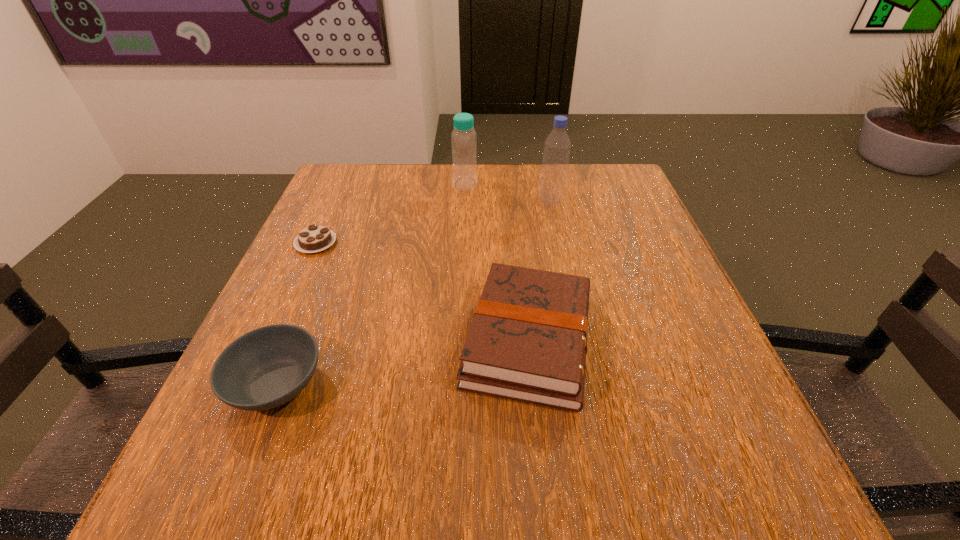
The height and width of the screenshot is (540, 960). Identify the location of free point at the near right corner. (708, 509).

The height and width of the screenshot is (540, 960). In order to click on free spot between the soup bowl and the fourth nearest object in this screenshot , I will do `click(414, 293)`.

The image size is (960, 540). Identify the location of free area in between the right bottle and the second shortest object. (414, 293).

What are the coordinates of `free space that is in between the shortest object and the farther bottle` in the screenshot? It's located at (391, 213).

The width and height of the screenshot is (960, 540). I want to click on free point between the fourth tallest object and the second farthest object, so click(x=414, y=293).

Find the location of `unoccupied area between the left bottle and the third farthest object`. unoccupied area between the left bottle and the third farthest object is located at coordinates (391, 213).

I want to click on vacant space that is in between the fourth tallest object and the chocolate cake, so click(x=297, y=314).

This screenshot has height=540, width=960. Identify the location of free space between the hardback book and the left bottle. (497, 262).

Find the location of a particular element. empty location between the left bottle and the hardback book is located at coordinates (497, 262).

Where is `vacant area between the hardback book and the soup bowl`? vacant area between the hardback book and the soup bowl is located at coordinates (402, 362).